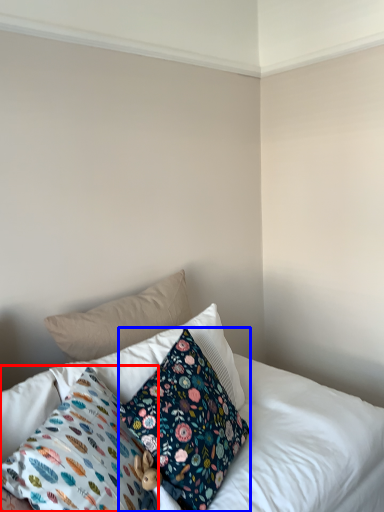
Question: Which object is closer to the camera taking this photo, pillow (highlighted by a red box) or pillow (highlighted by a blue box)?

Choices:
 (A) pillow
 (B) pillow

Answer: (A)